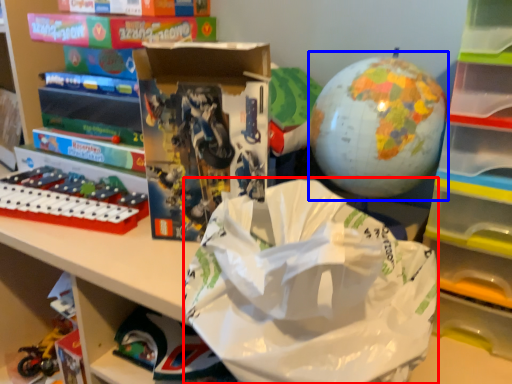
Question: Which of the following is the closest to the observer, grocery bag (highlighted by a red box) or toy (highlighted by a blue box)?

Choices:
 (A) grocery bag
 (B) toy

Answer: (A)